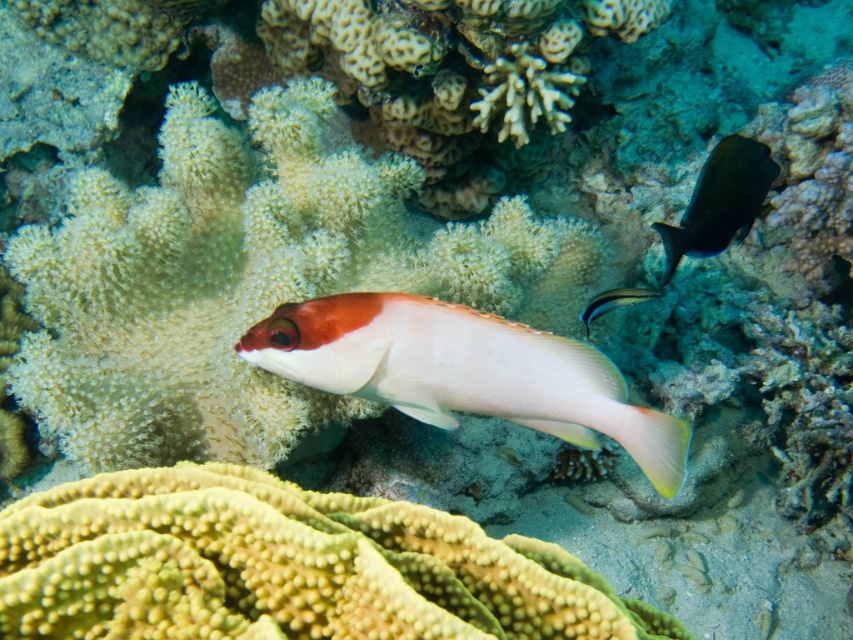
Question: Which point appears closest to the camera in this image?

Choices:
 (A) (737, 221)
 (B) (627, 289)

Answer: (A)

Question: Is matte white clownfish at center smaller than shiny black fish at upper right?

Choices:
 (A) yes
 (B) no

Answer: (A)

Question: Which point is farther to the camera?

Choices:
 (A) shiny silver fish at center
 (B) shiny black fish at upper right
 (C) matte white clownfish at center

Answer: (B)

Question: Which point is closer to the camera taking this photo?

Choices:
 (A) (700, 237)
 (B) (483, 365)
 (C) (645, 292)

Answer: (B)

Question: Considering the relative positions of shiny black fish at upper right and shiny silver fish at center in the image provided, where is shiny black fish at upper right located with respect to shiny silver fish at center?

Choices:
 (A) left
 (B) right

Answer: (B)

Question: Is shiny black fish at upper right in front of shiny silver fish at center?

Choices:
 (A) no
 (B) yes

Answer: (A)